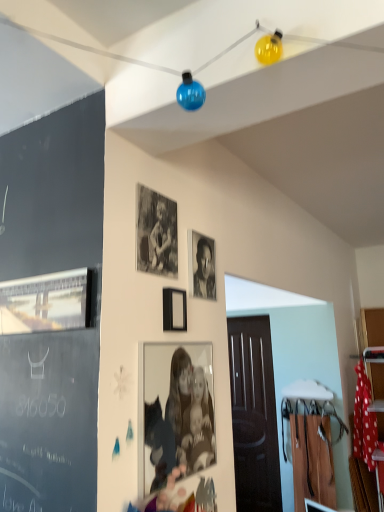
Question: From a real-world perspective, is black and white photograph at center positioned above or below matte black photo frame at center, the fourth picture frame in the top-to-bottom sequence?

Choices:
 (A) below
 (B) above

Answer: (B)

Question: Considering the positions of black and white photograph at center and matte black photo frame at center, acting as the first picture frame starting from the right, in the image, is black and white photograph at center bigger or smaller than matte black photo frame at center, acting as the first picture frame starting from the right,?

Choices:
 (A) small
 (B) big

Answer: (A)

Question: Estimate the real-world distances between objects in this image. Which object is farther from the matte black photo frame at center, which appears as the fourth picture frame when viewed from the left?

Choices:
 (A) black matte picture frame at center, which ranks as the second picture frame in right-to-left order
 (B) black and white photograph at center
 (C) black matte photo frame at upper center, the 1th picture frame viewed from the top
 (D) metallic silver picture frame at left, which is the 2th picture frame in top-to-bottom order

Answer: (C)

Question: Which is nearer to the black matte photo frame at upper center, which ranks as the third picture frame in right-to-left order?

Choices:
 (A) metallic silver picture frame at left, which is the 2th picture frame in top-to-bottom order
 (B) black and white photograph at center
 (C) black matte picture frame at center, positioned as the 3th picture frame in top-to-bottom order
 (D) matte black photo frame at center, the first picture frame in the bottom-to-top sequence

Answer: (C)